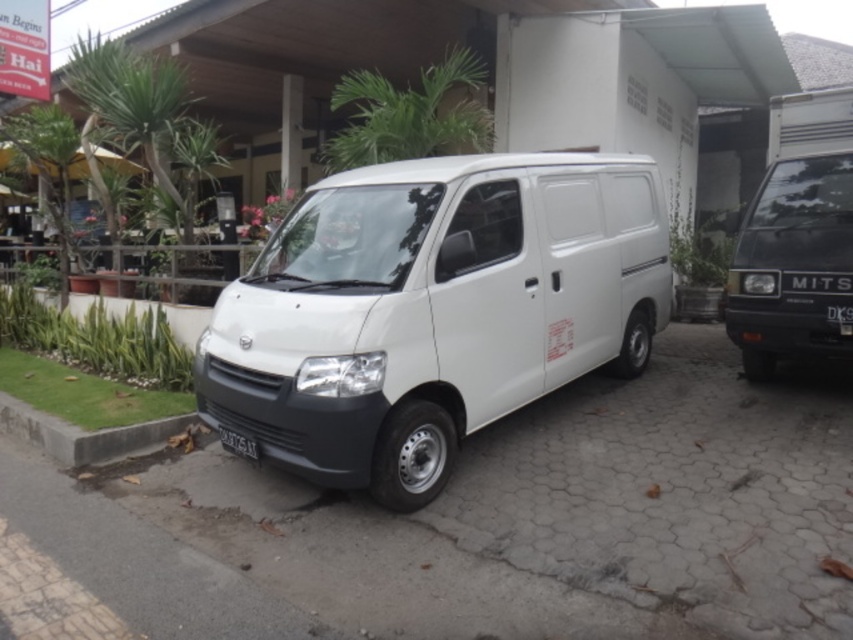
Does gray concrete curb at lower left appear on the left side of black plastic license plate at center?

Yes, gray concrete curb at lower left is to the left of black plastic license plate at center.

Can you confirm if gray concrete curb at lower left is positioned below black plastic license plate at center?

Yes.

At what (x,y) coordinates should I click in order to perform the action: click on gray concrete curb at lower left. Please return your answer as a coordinate pair (x, y). Looking at the image, I should click on (83, 433).

Which is in front, point (236, 451) or point (834, 320)?

Point (236, 451)

Identify the location of white plastic license plate at center. (236, 442).

The image size is (853, 640). Find the location of `white plastic license plate at center`. white plastic license plate at center is located at coordinates (236, 442).

Can you confirm if matte black minibus at right is wider than gray concrete curb at lower left?

Incorrect, matte black minibus at right's width does not surpass gray concrete curb at lower left's.

Is matte black minibus at right closer to camera compared to gray concrete curb at lower left?

No, it is not.

Locate an element on the screen. The height and width of the screenshot is (640, 853). matte black minibus at right is located at coordinates (795, 237).